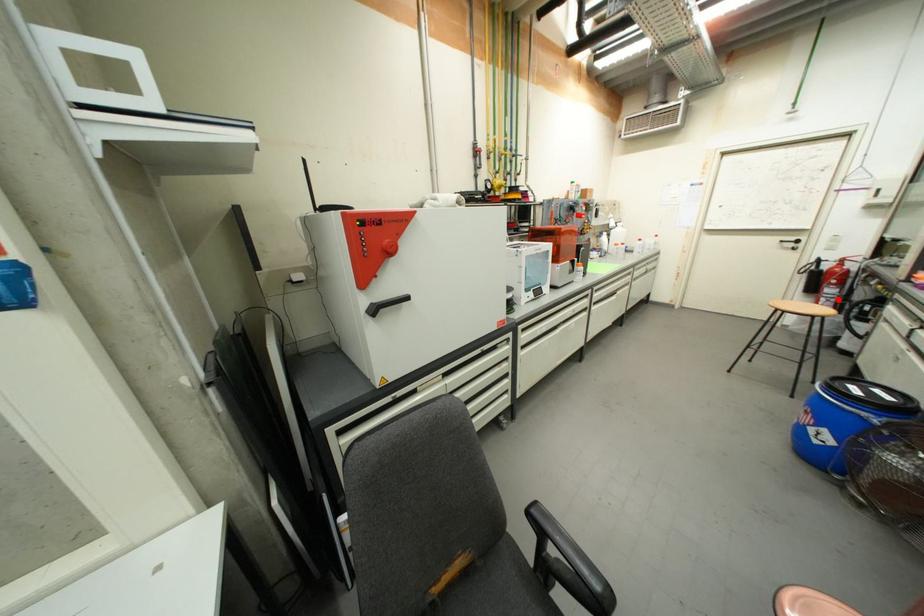
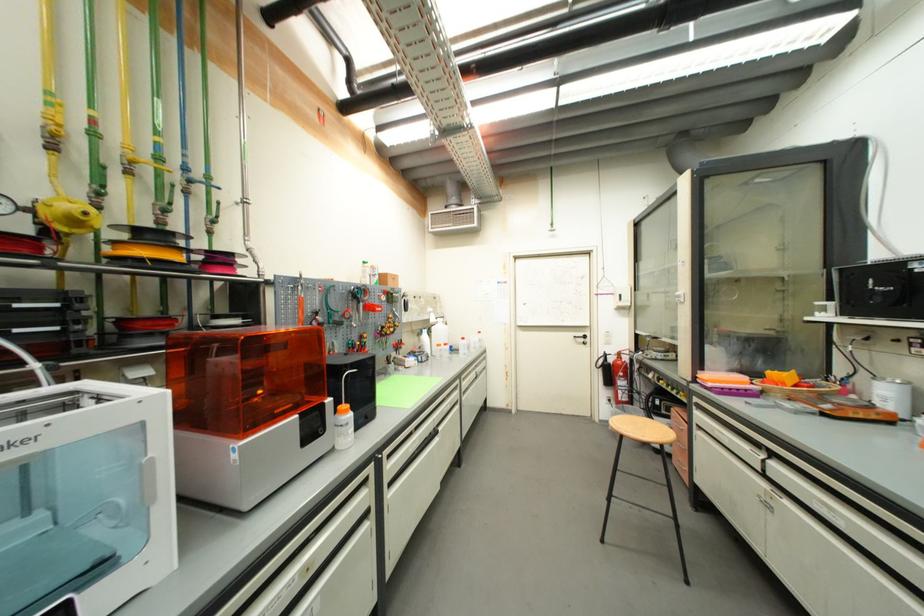
Question: A red point is marked in image1. In image2, is the corresponding 3D point closer to the camera or farther? Reply with the corresponding letter.

Choices:
 (A) The corresponding 3D point is closer.
 (B) The corresponding 3D point is farther.

Answer: (A)